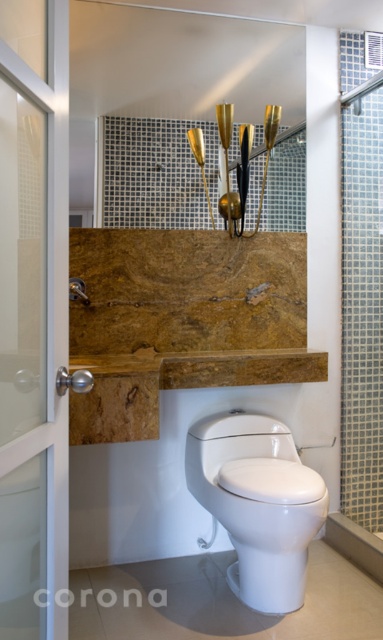
Question: Which object is farther from the camera taking this photo?

Choices:
 (A) clear glass door at left
 (B) white glossy toilet at center

Answer: (B)

Question: Is white glossy toilet at center closer to the viewer compared to clear glass door at left?

Choices:
 (A) yes
 (B) no

Answer: (B)

Question: Can you confirm if white glossy toilet at center is wider than clear glass door at left?

Choices:
 (A) yes
 (B) no

Answer: (A)

Question: Can you confirm if white glossy toilet at center is bigger than clear glass door at left?

Choices:
 (A) yes
 (B) no

Answer: (A)

Question: Which of the following is the closest to the observer?

Choices:
 (A) (234, 476)
 (B) (67, 534)

Answer: (B)